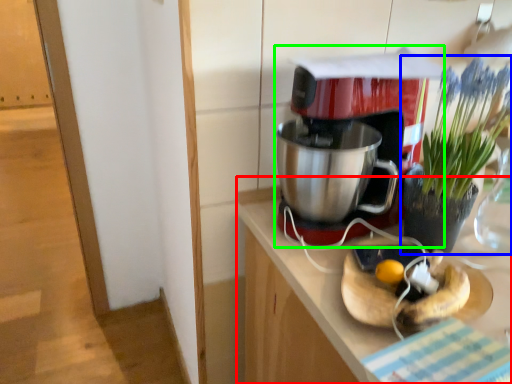
Question: Which object is the closest to the counter (highlighted by a red box)? Choose among these: houseplant (highlighted by a blue box) or coffee maker (highlighted by a green box).

Choices:
 (A) houseplant
 (B) coffee maker

Answer: (B)